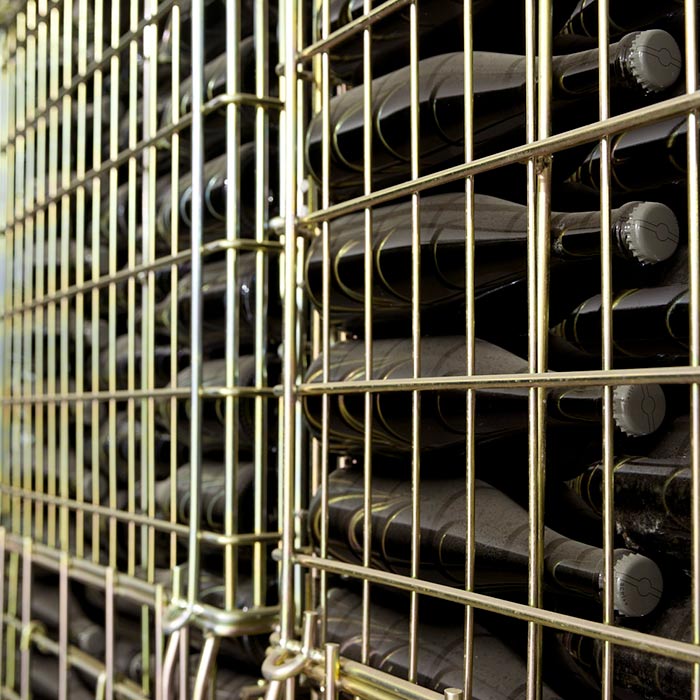
Where is `metal rack`? metal rack is located at coordinates (290, 206), (83, 570), (398, 687), (287, 17).